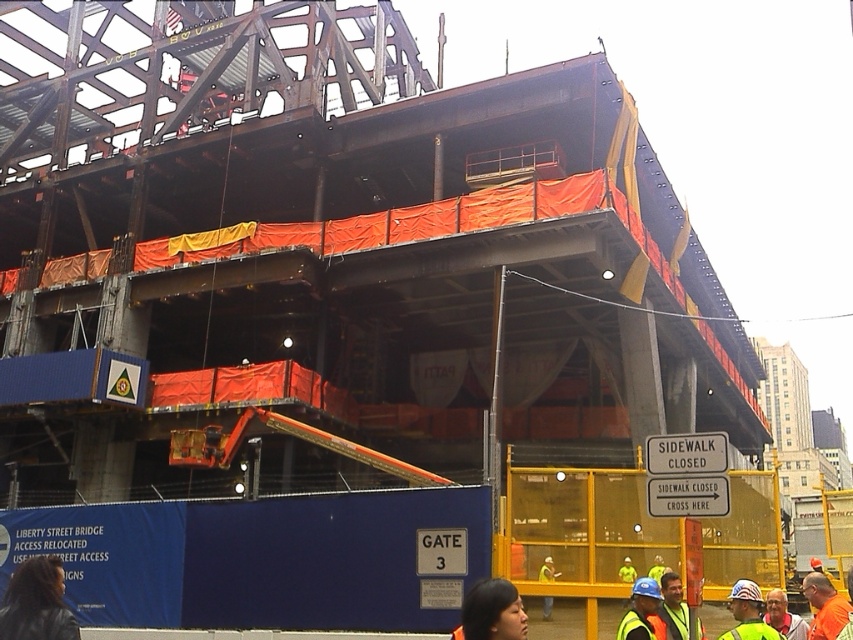
Does orange reflective vest at lower right have a smaller size compared to reflective safety vest at center?

No.

Is orange reflective vest at lower right bigger than reflective safety vest at center?

Correct, orange reflective vest at lower right is larger in size than reflective safety vest at center.

Is point (825, 600) closer to viewer compared to point (666, 580)?

That is True.

Identify the location of orange reflective vest at lower right. The width and height of the screenshot is (853, 640). (824, 605).

Which is more to the left, reflective safety vest at center or orange safety vest at lower right?

From the viewer's perspective, reflective safety vest at center appears more on the left side.

The height and width of the screenshot is (640, 853). I want to click on reflective safety vest at center, so click(670, 609).

I want to click on reflective safety vest at center, so click(670, 609).

Between orange reflective vest at lower right and reflective yellow vest at center, which one appears on the right side from the viewer's perspective?

Positioned to the right is orange reflective vest at lower right.

Based on the photo, which is more to the left, orange reflective vest at lower right or reflective yellow vest at center?

Positioned to the left is reflective yellow vest at center.

This screenshot has height=640, width=853. Identify the location of orange reflective vest at lower right. (824, 605).